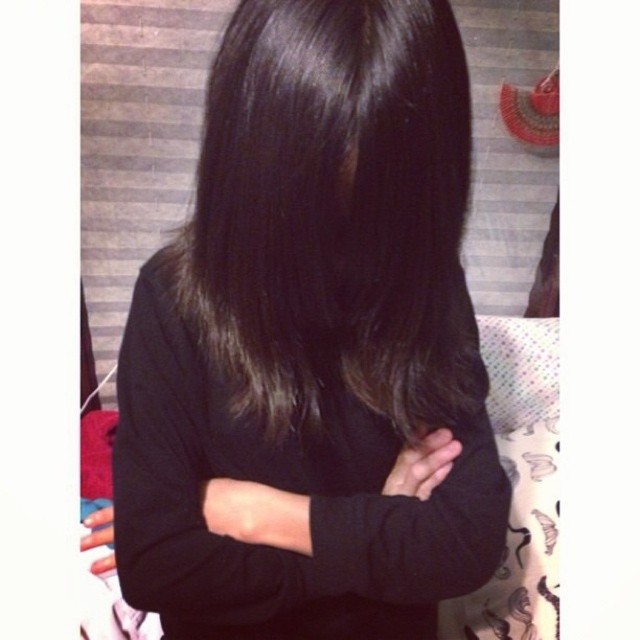
Does shiny dark brown hair at center have a smaller size compared to black matte sweater at center?

Correct, shiny dark brown hair at center occupies less space than black matte sweater at center.

Can you confirm if shiny dark brown hair at center is positioned above black matte sweater at center?

Yes, shiny dark brown hair at center is above black matte sweater at center.

Identify the location of shiny dark brown hair at center. (333, 212).

Locate an element on the screen. This screenshot has width=640, height=640. shiny dark brown hair at center is located at coordinates pos(333,212).